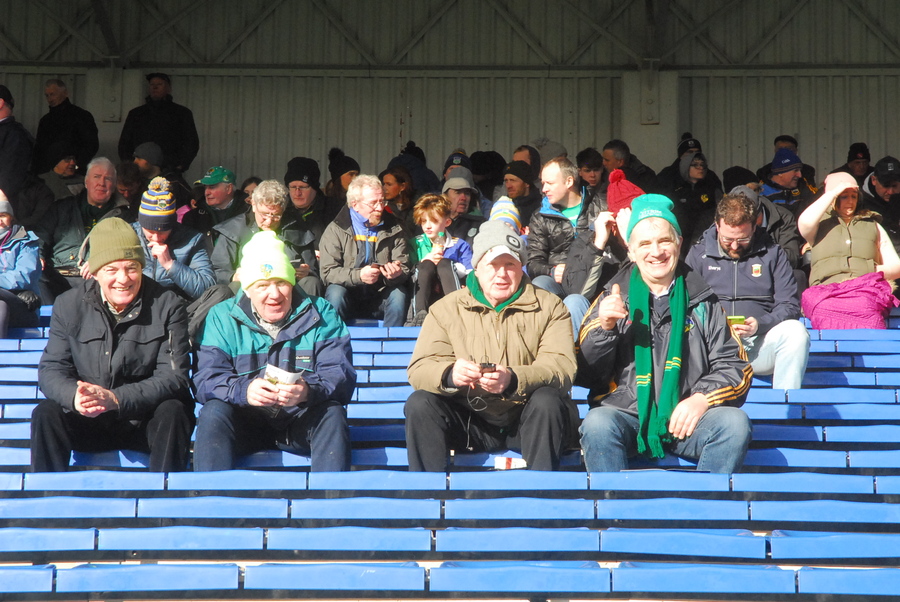
Locate an element on the screen. This screenshot has width=900, height=602. corner is located at coordinates coord(878,586), coord(23,582), coord(15,10), coord(879,14).